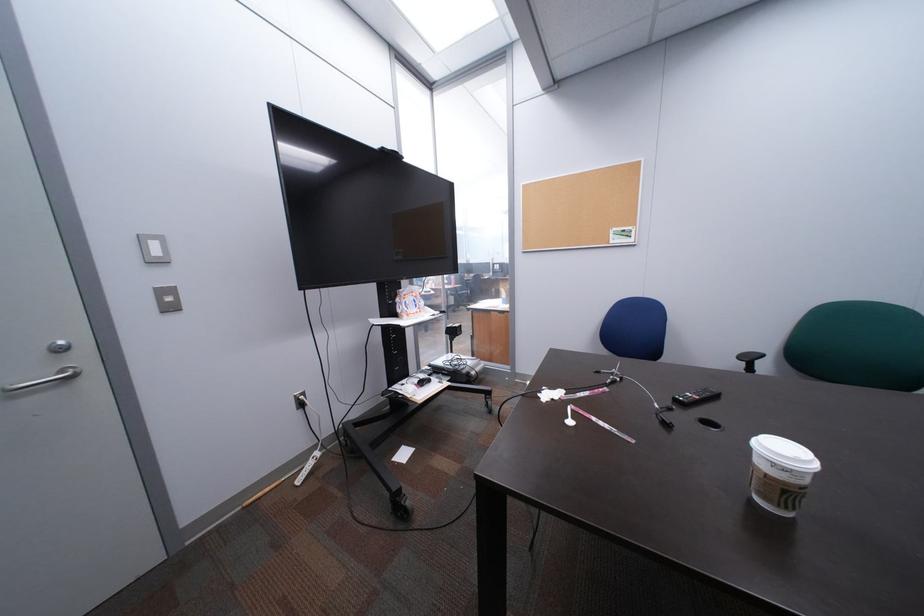
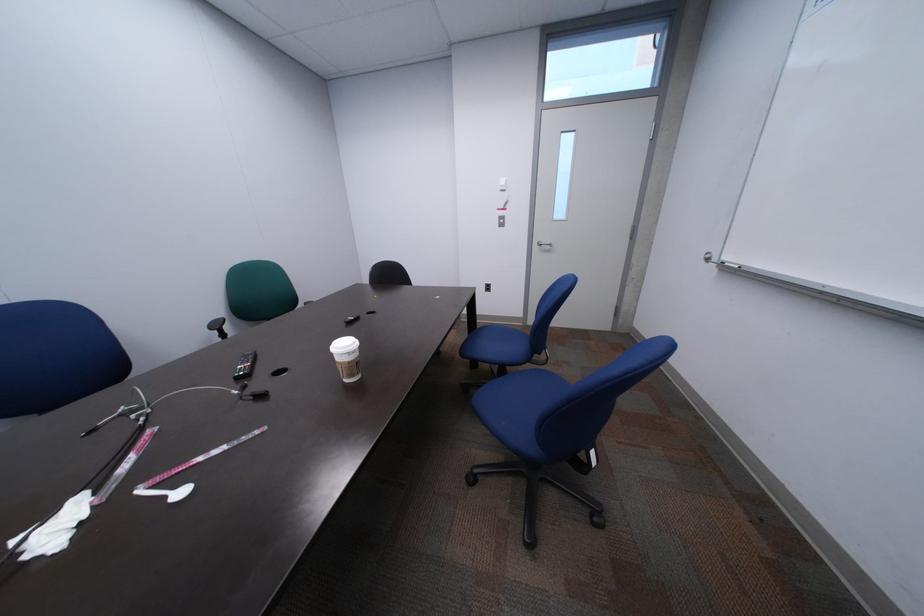
First-person continuous shooting, in which direction is the camera rotating?

The camera's rotation is toward right-down.